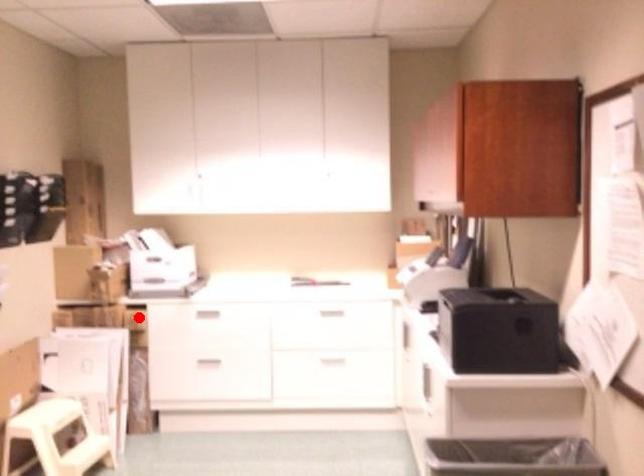
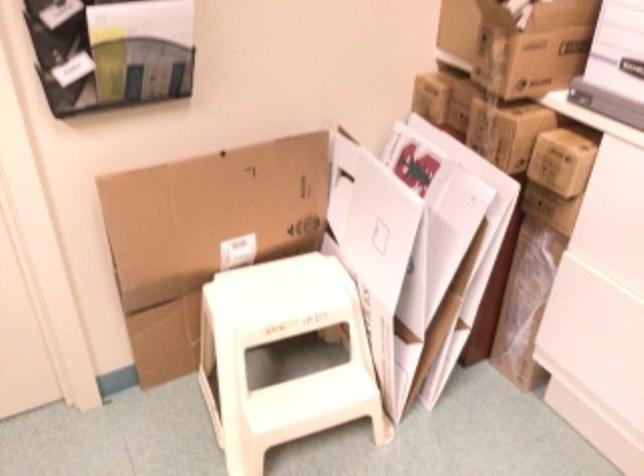
Question: A red point is marked in image1. In image2, is the corresponding 3D point closer to the camera or farther? Reply with the corresponding letter.

Choices:
 (A) The corresponding 3D point is closer.
 (B) The corresponding 3D point is farther.

Answer: (A)